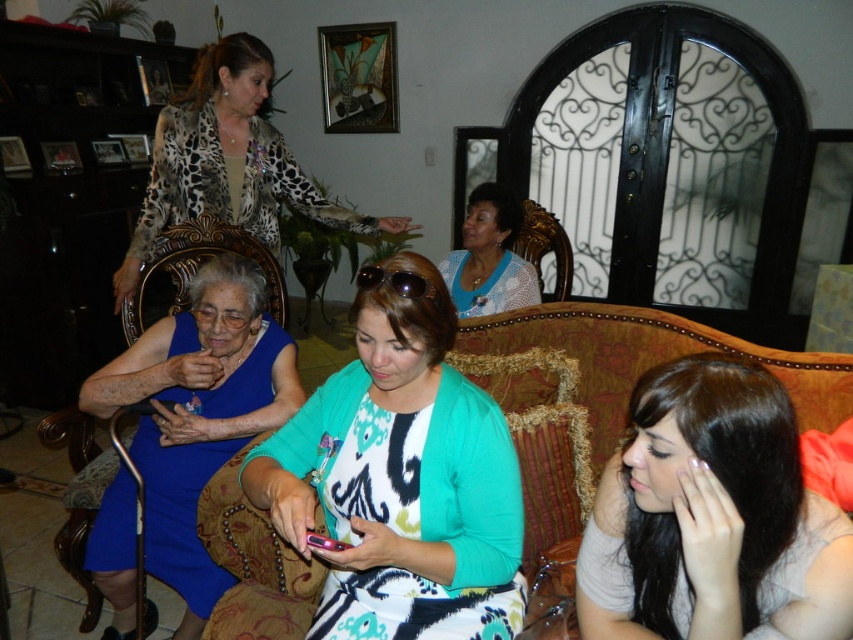
How distant is teal fabric shirt at center from blue satin dress at lower left?

20.77 inches

Is teal fabric shirt at center bigger than blue satin dress at lower left?

No, teal fabric shirt at center is not bigger than blue satin dress at lower left.

Which is in front, point (399, 465) or point (252, 380)?

Positioned in front is point (399, 465).

The height and width of the screenshot is (640, 853). I want to click on teal fabric shirt at center, so click(x=401, y=483).

Does blue satin dress at lower left come behind sunglasses at center?

Yes.

Does blue satin dress at lower left appear on the left side of sunglasses at center?

Correct, you'll find blue satin dress at lower left to the left of sunglasses at center.

Is point (277, 376) positioned in front of point (408, 280)?

No, it is not.

This screenshot has height=640, width=853. I want to click on blue satin dress at lower left, so click(198, 413).

Between teal fabric shirt at center and blue dotted blouse at center, which one has less height?

blue dotted blouse at center

Find the location of a particular element. The width and height of the screenshot is (853, 640). teal fabric shirt at center is located at coordinates (401, 483).